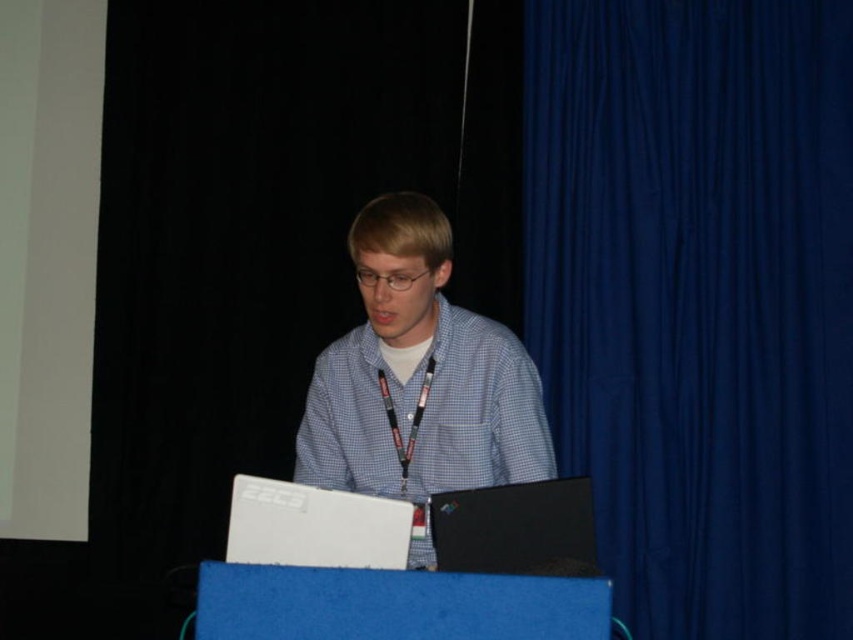
Is matte white shirt at center bigger than white plastic laptop at center?

Indeed, matte white shirt at center has a larger size compared to white plastic laptop at center.

Measure the distance between point [444,440] and camera.

Point [444,440] is 2.01 meters from camera.

Between point (410, 438) and point (370, 538), which one is positioned in front?

Point (370, 538) is in front.

At what (x,y) coordinates should I click in order to perform the action: click on matte white shirt at center. Please return your answer as a coordinate pair (x, y). Image resolution: width=853 pixels, height=640 pixels. Looking at the image, I should click on (418, 380).

Between point (787, 307) and point (527, 499), which one is positioned in front?

Point (527, 499) is in front.

Which is more to the left, blue fabric curtain at right or black matte laptop at center?

black matte laptop at center

The height and width of the screenshot is (640, 853). Describe the element at coordinates (698, 300) in the screenshot. I see `blue fabric curtain at right` at that location.

Identify the location of blue fabric curtain at right. The image size is (853, 640). (698, 300).

Who is shorter, blue fabric curtain at right or white plastic laptop at center?

white plastic laptop at center

Does point (747, 221) come farther from viewer compared to point (241, 502)?

Yes, it is behind point (241, 502).

Find the location of a particular element. The image size is (853, 640). blue fabric curtain at right is located at coordinates (698, 300).